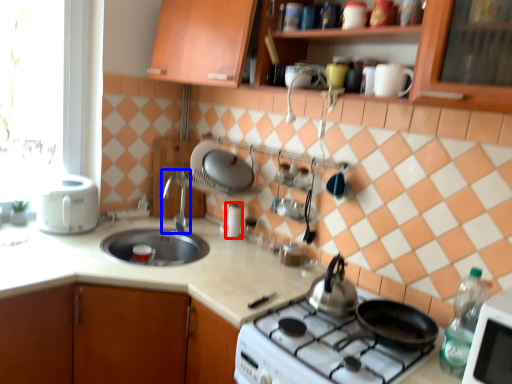
Question: Which object is further to the camera taking this photo, appliance (highlighted by a red box) or faucet (highlighted by a blue box)?

Choices:
 (A) appliance
 (B) faucet

Answer: (A)